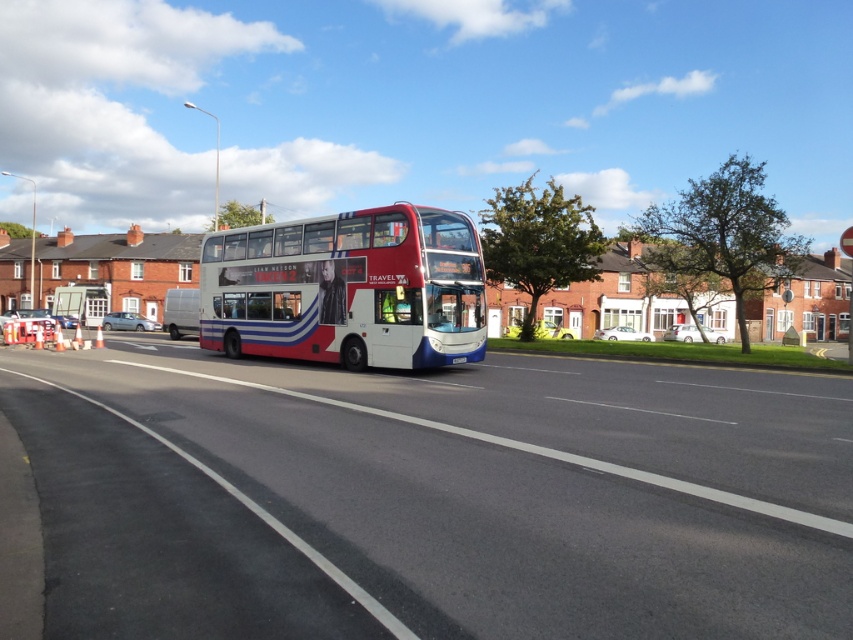
Question: Among these objects, which one is farthest from the camera?

Choices:
 (A) white glossy decker bus at center
 (B) white plastic license plate at center

Answer: (B)

Question: Can you confirm if white glossy decker bus at center is wider than white plastic license plate at center?

Choices:
 (A) no
 (B) yes

Answer: (B)

Question: Is white glossy decker bus at center smaller than white plastic license plate at center?

Choices:
 (A) no
 (B) yes

Answer: (A)

Question: Is white glossy decker bus at center below white plastic license plate at center?

Choices:
 (A) yes
 (B) no

Answer: (B)

Question: Which of the following is the farthest from the observer?

Choices:
 (A) (465, 358)
 (B) (428, 324)

Answer: (A)